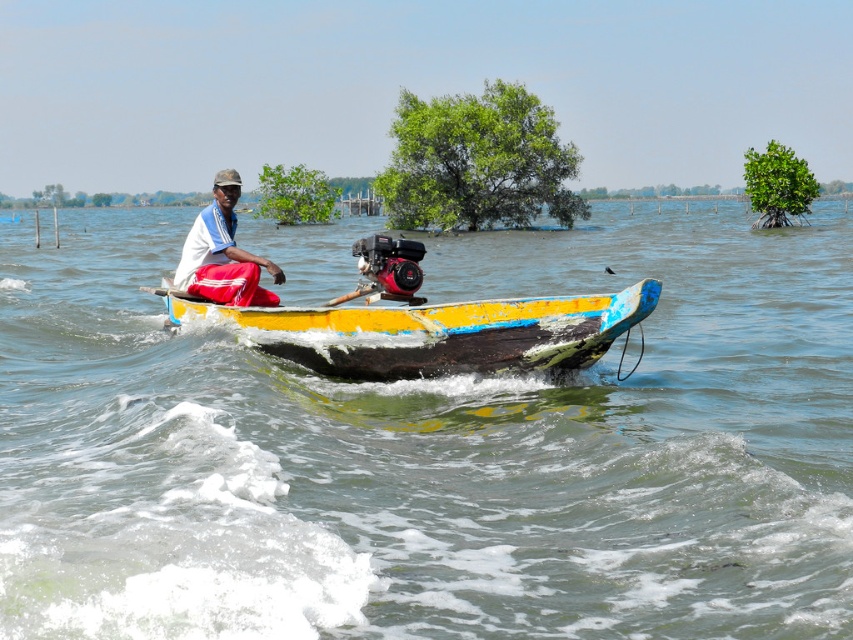
Can you confirm if clear water at boat front is positioned to the left of white fabric shirt at center?

Indeed, clear water at boat front is positioned on the left side of white fabric shirt at center.

What do you see at coordinates (433, 449) in the screenshot? I see `clear water at boat front` at bounding box center [433, 449].

Locate an element on the screen. clear water at boat front is located at coordinates (433, 449).

Where is `yellow painted wood canoe at center`? yellow painted wood canoe at center is located at coordinates (442, 332).

Who is positioned more to the left, yellow painted wood canoe at center or white fabric shirt at center?

From the viewer's perspective, white fabric shirt at center appears more on the left side.

Describe the element at coordinates (442, 332) in the screenshot. This screenshot has height=640, width=853. I see `yellow painted wood canoe at center` at that location.

Locate an element on the screen. This screenshot has width=853, height=640. yellow painted wood canoe at center is located at coordinates (442, 332).

Is clear water at boat front smaller than yellow painted wood canoe at center?

Incorrect, clear water at boat front is not smaller in size than yellow painted wood canoe at center.

Who is higher up, clear water at boat front or yellow painted wood canoe at center?

Positioned higher is clear water at boat front.

Which is in front, point (33, 273) or point (538, 310)?

Point (538, 310)

Where is `clear water at boat front`? The width and height of the screenshot is (853, 640). clear water at boat front is located at coordinates (433, 449).